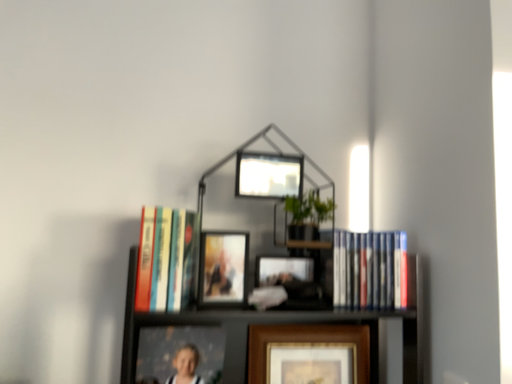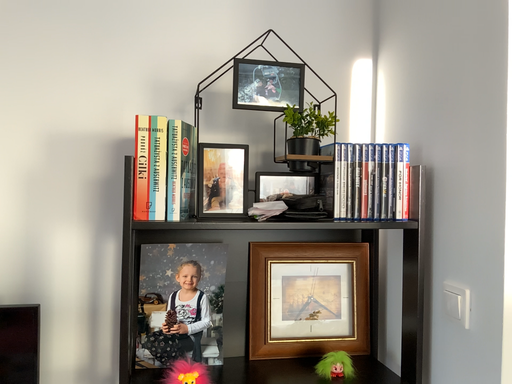
Question: Which way did the camera rotate in the video?

Choices:
 (A) rotated downward
 (B) rotated upward

Answer: (A)